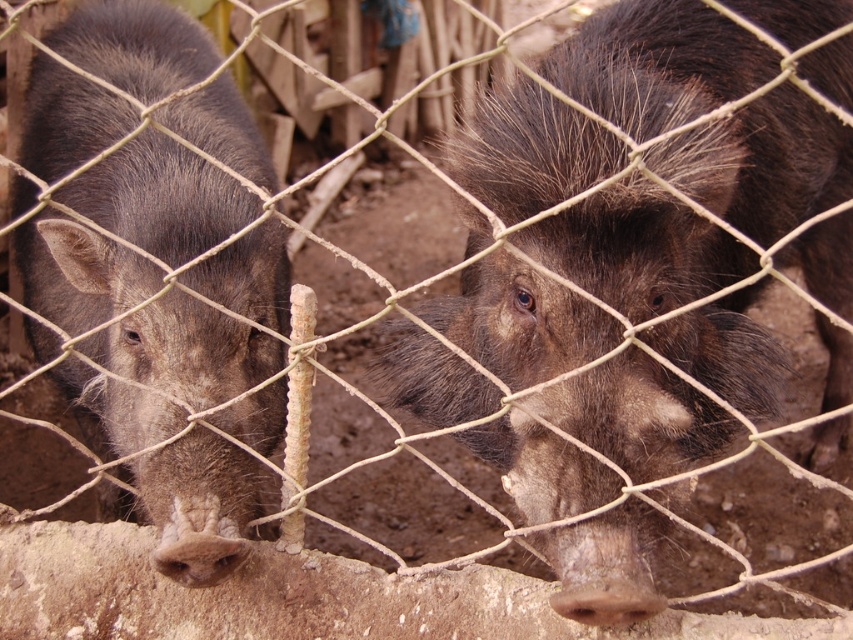
You are a farmer checking the fence between the brown fuzzy pig at center and the dark brown fur at left. Which pig is bigger?

The brown fuzzy pig at center is larger in size compared to the dark brown fur at left.

You are a photographer standing in front of the wire mesh fence. You want to take a photo of the brown fuzzy pig at center and the dark brown fur at left. Which pig is positioned closer to you?

The brown fuzzy pig at center is closer to the viewer than the dark brown fur at left, so the brown fuzzy pig at center would be the one positioned closer to you.

You are a farmer checking on your pigs. You see the brown fuzzy pig at center and the dark brown fur at left. Which pig is located to the right of the other?

Result: The brown fuzzy pig at center is positioned on the right side of dark brown fur at left, so the brown fuzzy pig at center is to the right of the dark brown fur at left.